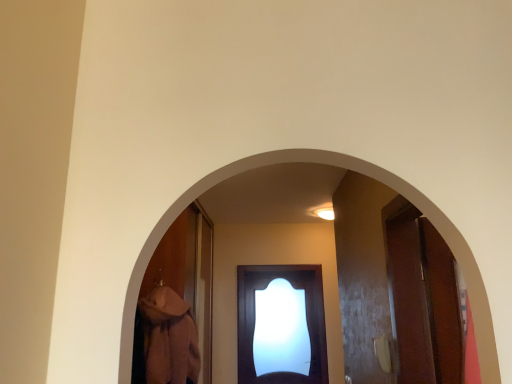
What do you see at coordinates (325, 213) in the screenshot? I see `white glossy light at upper center` at bounding box center [325, 213].

Measure the distance between matte dark wood door at center and camera.

matte dark wood door at center is 4.51 meters from camera.

The image size is (512, 384). In order to click on matte dark wood door at center in this screenshot , I will do `click(305, 316)`.

I want to click on white glossy light at upper center, so click(x=325, y=213).

In the scene shown: How many degrees apart are the facing directions of matte dark wood door at center and white glossy light at upper center?

1.62 degrees separate the facing orientations of matte dark wood door at center and white glossy light at upper center.

Relative to white glossy light at upper center, is matte dark wood door at center in front or behind?

Clearly, matte dark wood door at center is behind white glossy light at upper center.

Between matte dark wood door at center and white glossy light at upper center, which one has larger width?

Wider between the two is white glossy light at upper center.

From the image's perspective, is matte dark wood door at center positioned above or below white glossy light at upper center?

Clearly, from the image's perspective, matte dark wood door at center is below white glossy light at upper center.

Measure the distance from smooth wooden archway at center to matte dark wood door at center.

smooth wooden archway at center is 3.93 meters from matte dark wood door at center.

Would you consider smooth wooden archway at center to be distant from matte dark wood door at center?

That's right, there is a large distance between smooth wooden archway at center and matte dark wood door at center.

From a real-world perspective, is smooth wooden archway at center positioned over matte dark wood door at center based on gravity?

Yes, from a real-world perspective, smooth wooden archway at center is above matte dark wood door at center.

Is smooth wooden archway at center closer to camera compared to matte dark wood door at center?

That is True.

How different are the orientations of white glossy light at upper center and matte dark wood door at center in degrees?

The angle between the facing direction of white glossy light at upper center and the facing direction of matte dark wood door at center is 1.62 degrees.

Considering the relative sizes of white glossy light at upper center and matte dark wood door at center in the image provided, is white glossy light at upper center taller than matte dark wood door at center?

In fact, white glossy light at upper center may be shorter than matte dark wood door at center.

Which object is positioned more to the left, white glossy light at upper center or matte dark wood door at center?

matte dark wood door at center.

From a real-world perspective, is white glossy light at upper center physically above matte dark wood door at center?

Yes, from a real-world perspective, white glossy light at upper center is above matte dark wood door at center.

This screenshot has height=384, width=512. In order to click on archway located above the white glossy light at upper center (from the image's perspective) in this screenshot , I will do `click(353, 170)`.

From the image's perspective, is white glossy light at upper center on smooth wooden archway at center?

No, from the image's perspective, white glossy light at upper center is not over smooth wooden archway at center.

Is the depth of white glossy light at upper center less than that of smooth wooden archway at center?

No.

Considering the relative positions of white glossy light at upper center and smooth wooden archway at center in the image provided, is white glossy light at upper center to the left of smooth wooden archway at center from the viewer's perspective?

No, white glossy light at upper center is not to the left of smooth wooden archway at center.

Considering the sizes of objects matte dark wood door at center and smooth wooden archway at center in the image provided, who is taller, matte dark wood door at center or smooth wooden archway at center?

matte dark wood door at center is taller.

Is point (248, 383) positioned behind point (490, 372)?

Yes, point (248, 383) is behind point (490, 372).

Is matte dark wood door at center to the left of smooth wooden archway at center from the viewer's perspective?

No.

Between smooth wooden archway at center and white glossy light at upper center, which one has more height?

Standing taller between the two is smooth wooden archway at center.

Who is smaller, smooth wooden archway at center or white glossy light at upper center?

With smaller size is white glossy light at upper center.

Considering the relative sizes of smooth wooden archway at center and white glossy light at upper center in the image provided, is smooth wooden archway at center wider than white glossy light at upper center?

No, smooth wooden archway at center is not wider than white glossy light at upper center.

From a real-world perspective, is smooth wooden archway at center on top of white glossy light at upper center?

Incorrect, from a real-world perspective, smooth wooden archway at center is lower than white glossy light at upper center.

I want to click on light above the matte dark wood door at center (from the image's perspective), so click(325, 213).

Identify the location of door behind the smooth wooden archway at center. The width and height of the screenshot is (512, 384). (305, 316).

Estimate the real-world distances between objects in this image. Which object is further from matte dark wood door at center, smooth wooden archway at center or white glossy light at upper center?

smooth wooden archway at center lies further to matte dark wood door at center than the other object.

Estimate the real-world distances between objects in this image. Which object is further from white glossy light at upper center, matte dark wood door at center or smooth wooden archway at center?

Based on the image, smooth wooden archway at center appears to be further to white glossy light at upper center.

From the image, which object appears to be farther from smooth wooden archway at center, white glossy light at upper center or matte dark wood door at center?

Based on the image, matte dark wood door at center appears to be further to smooth wooden archway at center.

Based on their spatial positions, is white glossy light at upper center or smooth wooden archway at center closer to matte dark wood door at center?

white glossy light at upper center is closer to matte dark wood door at center.

Looking at the image, which one is located further to smooth wooden archway at center, matte dark wood door at center or white glossy light at upper center?

The object further to smooth wooden archway at center is matte dark wood door at center.

Estimate the real-world distances between objects in this image. Which object is further from white glossy light at upper center, smooth wooden archway at center or matte dark wood door at center?

Based on the image, smooth wooden archway at center appears to be further to white glossy light at upper center.

This screenshot has height=384, width=512. In order to click on light between smooth wooden archway at center and matte dark wood door at center from front to back in this screenshot , I will do `click(325, 213)`.